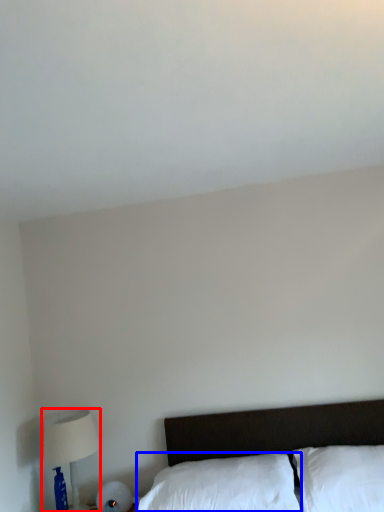
Question: Which of the following is the closest to the observer, table lamp (highlighted by a red box) or pillow (highlighted by a blue box)?

Choices:
 (A) table lamp
 (B) pillow

Answer: (B)